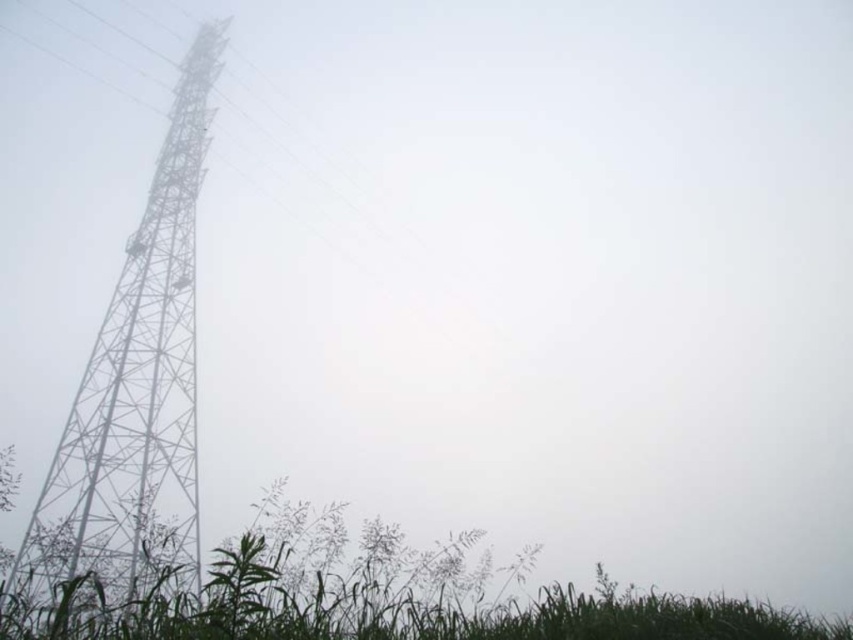
Between metallic tower at left and green grass at lower left, which one has more height?

metallic tower at left

The width and height of the screenshot is (853, 640). Identify the location of metallic tower at left. (136, 392).

Is metallic tower at left above green grassy at lower left?

Yes, metallic tower at left is above green grassy at lower left.

Who is positioned more to the right, metallic tower at left or green grassy at lower left?

green grassy at lower left is more to the right.

Who is more forward, (196, 545) or (454, 564)?

Point (454, 564)

Find the location of a particular element. The image size is (853, 640). metallic tower at left is located at coordinates (x=136, y=392).

Is green grassy at lower left behind green grass at lower left?

Yes, green grassy at lower left is further from the viewer.

Who is positioned more to the right, green grassy at lower left or green grass at lower left?

Positioned to the right is green grassy at lower left.

Is point (668, 618) positioned after point (242, 596)?

No, it is in front of (242, 596).

Identify the location of green grassy at lower left. (387, 608).